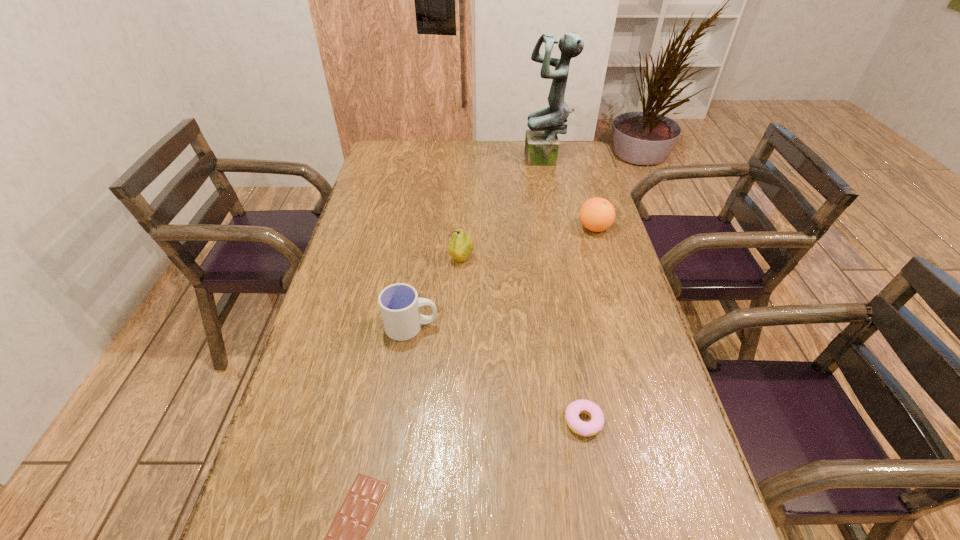
The width and height of the screenshot is (960, 540). What are the coordinates of `free space located 0.220m on the face of the tallest object` in the screenshot? It's located at (470, 160).

The width and height of the screenshot is (960, 540). In order to click on vacant space located 0.340m on the right of the fourth nearest object in this screenshot , I will do `click(584, 259)`.

Where is `vacant region located with the handle on the side of the cup`? This screenshot has height=540, width=960. vacant region located with the handle on the side of the cup is located at coordinates (529, 327).

What are the coordinates of `free spot located on the left of the second farthest object` in the screenshot? It's located at (533, 228).

Locate an element on the screen. The width and height of the screenshot is (960, 540). vacant space located on the left of the fifth tallest object is located at coordinates 515,422.

Where is `object located at the far edge`? The height and width of the screenshot is (540, 960). object located at the far edge is located at coordinates (541, 141).

This screenshot has height=540, width=960. I want to click on sculpture that is at the right edge, so click(541, 141).

This screenshot has height=540, width=960. Find the location of `orange positioned at the right edge`. orange positioned at the right edge is located at coordinates click(x=597, y=214).

At what (x,y) coordinates should I click in order to perform the action: click on object positioned at the far right corner. Please return your answer as a coordinate pair (x, y). Looking at the image, I should click on (541, 141).

Where is `free space at the far edge of the desktop`? free space at the far edge of the desktop is located at coordinates (509, 164).